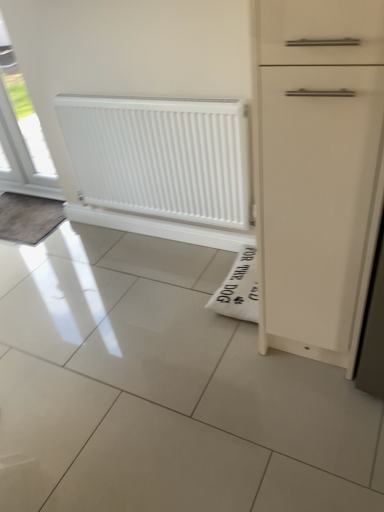
The image size is (384, 512). What are the coordinates of `white glossy window at upper left` in the screenshot? It's located at (21, 133).

Which object is thinner, dark gray textured mat at left or white smooth radiator at center?

With smaller width is white smooth radiator at center.

From a real-world perspective, is dark gray textured mat at left physically located above or below white smooth radiator at center?

dark gray textured mat at left is situated lower than white smooth radiator at center in the real world.

Is dark gray textured mat at left looking in the opposite direction of white smooth radiator at center?

dark gray textured mat at left does not have its back to white smooth radiator at center.

Does point (49, 225) appear closer or farther from the camera than point (151, 159)?

Clearly, point (49, 225) is more distant from the camera than point (151, 159).

From the image's perspective, would you say white smooth radiator at center is shown under dark gray textured mat at left?

No.

Which is in front, point (192, 115) or point (8, 202)?

Positioned in front is point (192, 115).

Which is behind, white smooth radiator at center or dark gray textured mat at left?

Positioned behind is dark gray textured mat at left.

Does white smooth radiator at center appear on the right side of dark gray textured mat at left?

Indeed, white smooth radiator at center is positioned on the right side of dark gray textured mat at left.

From the image's perspective, is white glossy window at upper left located above or below dark gray textured mat at left?

Based on their image positions, white glossy window at upper left is located above dark gray textured mat at left.

Considering the relative positions of white glossy window at upper left and dark gray textured mat at left in the image provided, is white glossy window at upper left to the left or to the right of dark gray textured mat at left?

Clearly, white glossy window at upper left is on the right of dark gray textured mat at left in the image.

Considering the sizes of objects white glossy window at upper left and dark gray textured mat at left in the image provided, who is shorter, white glossy window at upper left or dark gray textured mat at left?

With less height is dark gray textured mat at left.

Considering the positions of points (20, 221) and (3, 94), is point (20, 221) farther from camera compared to point (3, 94)?

That is False.

The width and height of the screenshot is (384, 512). I want to click on window in front of the dark gray textured mat at left, so click(21, 133).

From the image's perspective, is dark gray textured mat at left above or below white glossy window at upper left?

Based on their image positions, dark gray textured mat at left is located beneath white glossy window at upper left.

The image size is (384, 512). Find the location of `window that is above the white smooth radiator at center (from a real-world perspective)`. window that is above the white smooth radiator at center (from a real-world perspective) is located at coordinates (21, 133).

Which object is more forward, white glossy window at upper left or white smooth radiator at center?

Positioned in front is white smooth radiator at center.

Can you confirm if white glossy window at upper left is taller than white smooth radiator at center?

Yes.

From the image's perspective, between white glossy window at upper left and white smooth radiator at center, which one is located above?

white glossy window at upper left, from the image's perspective.

Is white smooth radiator at center positioned with its back to white glossy window at upper left?

No, white smooth radiator at center is not facing the opposite direction of white glossy window at upper left.

How distant is white smooth radiator at center from white glossy window at upper left?

white smooth radiator at center and white glossy window at upper left are 9.19 feet apart.

From a real-world perspective, who is located lower, white smooth radiator at center or white glossy window at upper left?

From a 3D spatial view, white smooth radiator at center is below.

Which is in front, point (194, 143) or point (40, 174)?

The point (194, 143) is in front.

There is a dark gray textured mat at left. Where is `radiator above it (from a real-world perspective)`? The image size is (384, 512). radiator above it (from a real-world perspective) is located at coordinates (161, 157).

Identify the location of radiator on the right of the dark gray textured mat at left. This screenshot has height=512, width=384. (161, 157).

Considering their positions, is dark gray textured mat at left positioned further to white smooth radiator at center than white glossy window at upper left?

white glossy window at upper left lies further to white smooth radiator at center than the other object.

Based on their spatial positions, is white glossy window at upper left or dark gray textured mat at left further from white smooth radiator at center?

Among the two, white glossy window at upper left is located further to white smooth radiator at center.

Based on their spatial positions, is dark gray textured mat at left or white smooth radiator at center closer to white glossy window at upper left?

dark gray textured mat at left is positioned closer to the anchor white glossy window at upper left.

Based on their spatial positions, is white glossy window at upper left or white smooth radiator at center closer to dark gray textured mat at left?

Based on the image, white smooth radiator at center appears to be nearer to dark gray textured mat at left.

Estimate the real-world distances between objects in this image. Which object is further from dark gray textured mat at left, white smooth radiator at center or white glossy window at upper left?

white glossy window at upper left lies further to dark gray textured mat at left than the other object.

Estimate the real-world distances between objects in this image. Which object is closer to white glossy window at upper left, white smooth radiator at center or dark gray textured mat at left?

The object closer to white glossy window at upper left is dark gray textured mat at left.

Locate an element on the screen. window between dark gray textured mat at left and white smooth radiator at center is located at coordinates (21, 133).